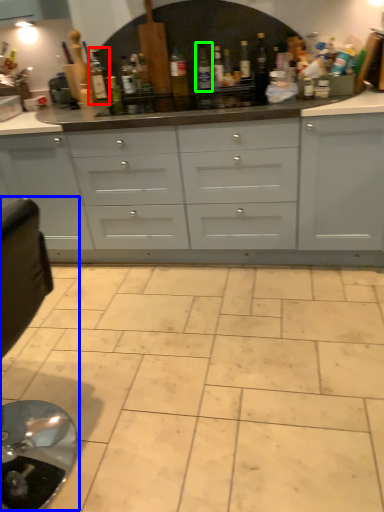
Question: Which object is positioned farthest from bottle (highlighted by a red box)? Select from swivel chair (highlighted by a blue box) and bottle (highlighted by a green box).

Choices:
 (A) swivel chair
 (B) bottle

Answer: (A)